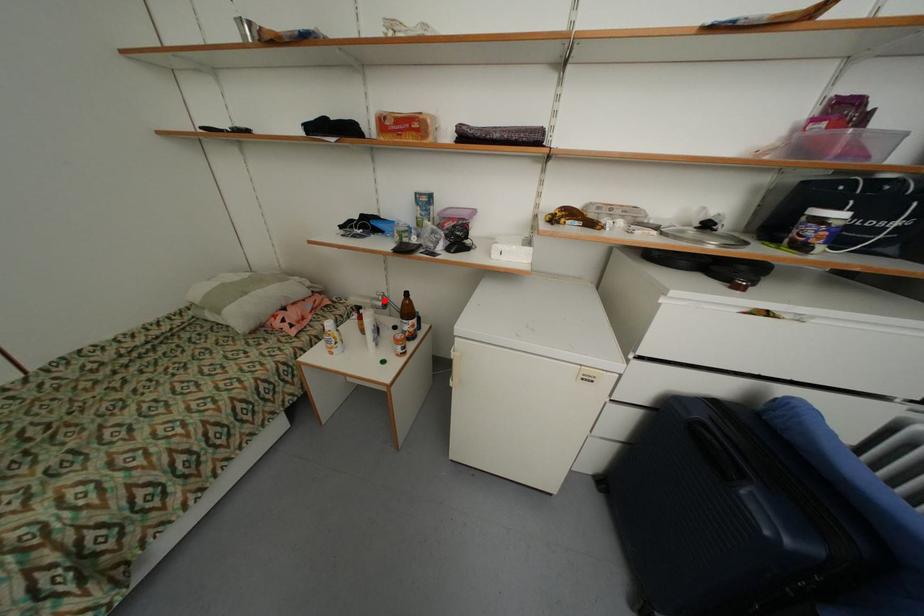
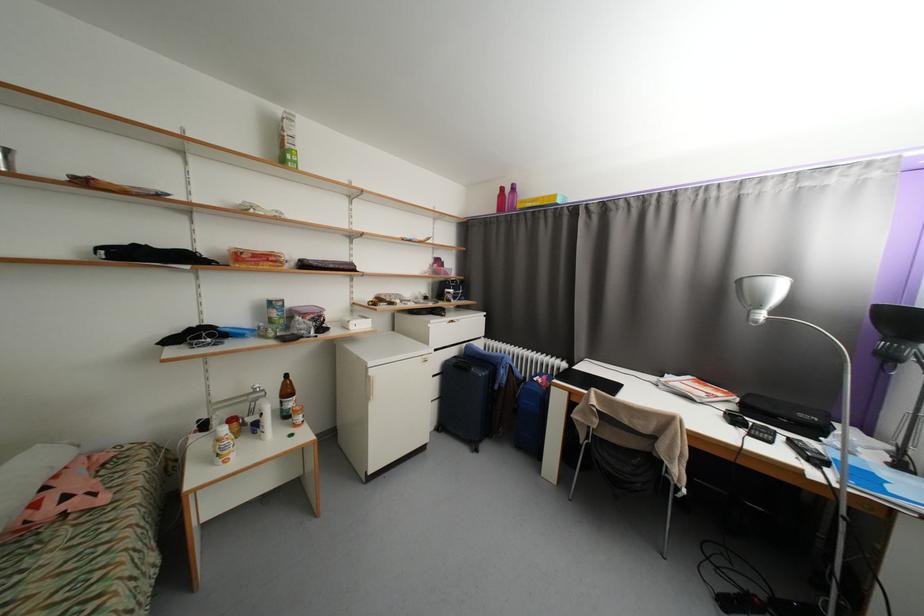
Locate, in the second image, the point that corresponds to the highlighted location in the first image.

(261, 392)